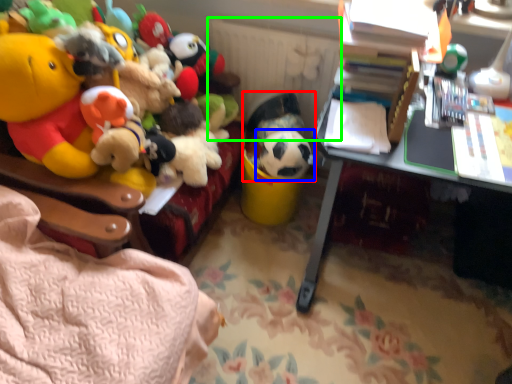
Question: Estimate the real-world distances between objects in this image. Which object is closer to toy (highlighted by a red box), toy (highlighted by a blue box) or radiator (highlighted by a green box)?

Choices:
 (A) toy
 (B) radiator

Answer: (A)